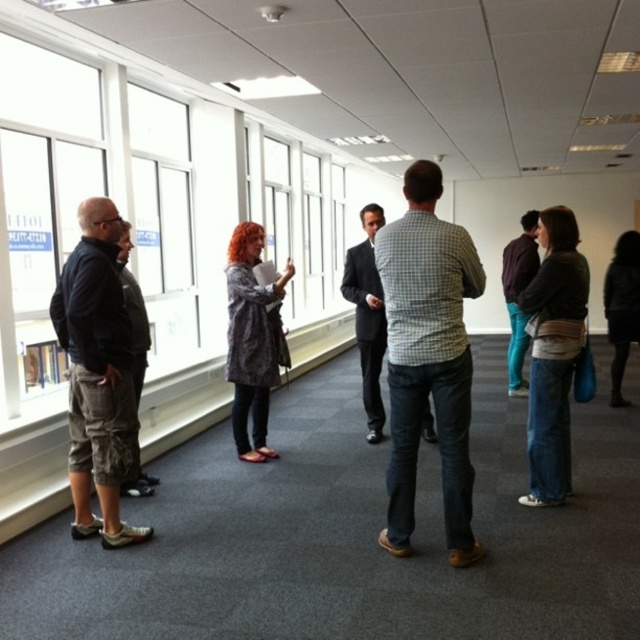
Question: Which of the following is the farthest from the observer?

Choices:
 (A) denim jeans at lower right
 (B) patterned fabric coat at center

Answer: (B)

Question: Can you confirm if denim jeans at lower right is positioned below patterned fabric coat at center?

Choices:
 (A) yes
 (B) no

Answer: (A)

Question: Which of the following is the closest to the observer?

Choices:
 (A) denim jeans at lower right
 (B) patterned fabric coat at center

Answer: (A)

Question: Is denim jeans at lower right bigger than patterned fabric coat at center?

Choices:
 (A) no
 (B) yes

Answer: (A)

Question: Can you confirm if denim jeans at lower right is wider than patterned fabric coat at center?

Choices:
 (A) yes
 (B) no

Answer: (B)